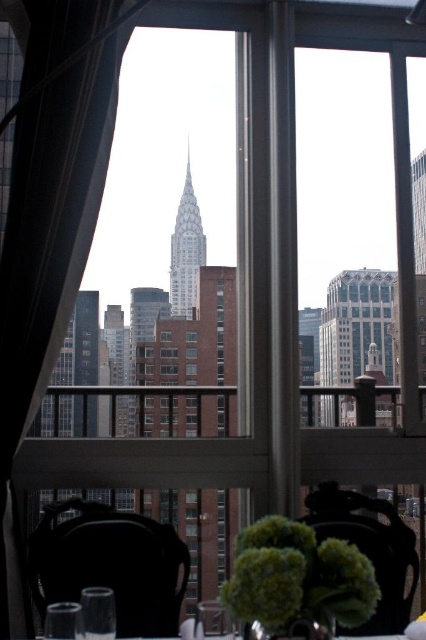
From the picture: Can you confirm if satin white curtain at left is thinner than clear glass wine glass at lower center?

Incorrect, satin white curtain at left's width is not less than clear glass wine glass at lower center's.

Consider the image. Who is more distant from viewer, [34,291] or [201,612]?

The point [201,612] is behind.

Image resolution: width=426 pixels, height=640 pixels. In order to click on satin white curtain at left in this screenshot , I will do `click(51, 204)`.

Is transparent glass at lower left wider than clear glass table at center?

Incorrect, transparent glass at lower left's width does not surpass clear glass table at center's.

Which of these two, transparent glass at lower left or clear glass table at center, stands shorter?

clear glass table at center

What do you see at coordinates (97, 612) in the screenshot? The image size is (426, 640). I see `transparent glass at lower left` at bounding box center [97, 612].

What are the coordinates of `transparent glass at lower left` in the screenshot? It's located at (97, 612).

Between point (339, 630) and point (104, 588), which one is positioned in front?

Positioned in front is point (339, 630).

Measure the distance between matte black chair at lower center and transparent glass at lower left.

They are 44.10 meters apart.

Is point (379, 540) positioned in front of point (95, 604)?

No.

Find the location of `matte black chair at lower center`. matte black chair at lower center is located at coordinates pyautogui.click(x=370, y=548).